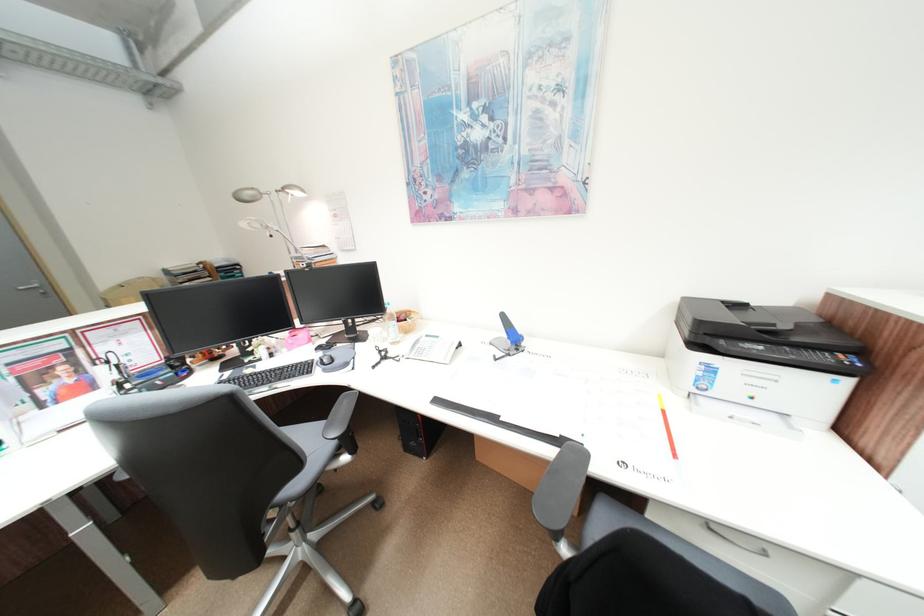
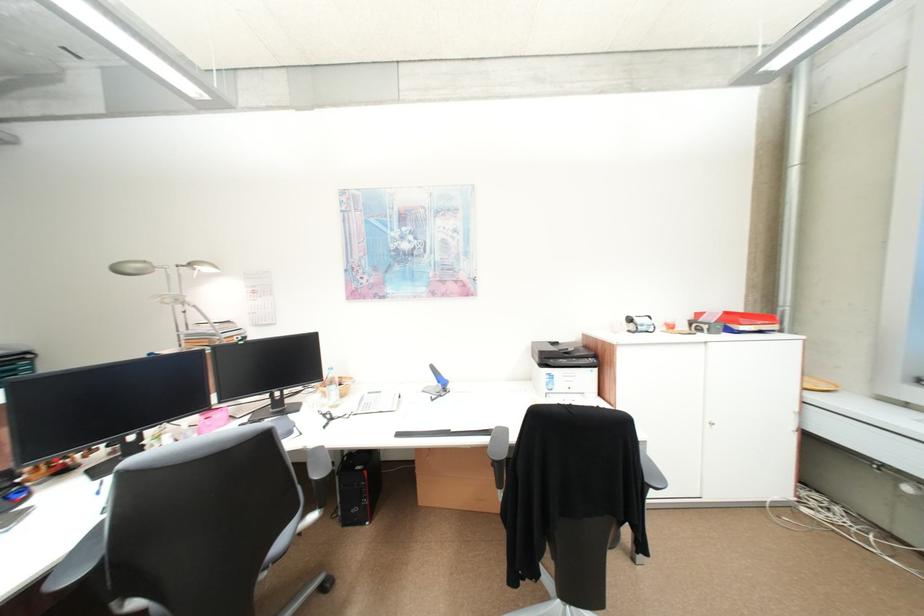
In the second image, find the point that corresponds to point (248, 200) in the first image.

(127, 272)